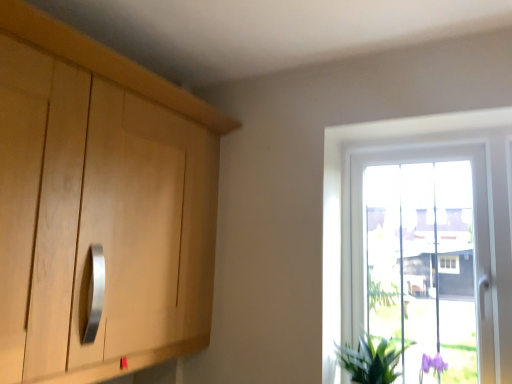
Question: From a real-world perspective, is transparent glass window at right above or below green leafy plant at lower right?

Choices:
 (A) below
 (B) above

Answer: (B)

Question: Is transparent glass window at right bigger or smaller than green leafy plant at lower right?

Choices:
 (A) small
 (B) big

Answer: (B)

Question: In terms of width, does transparent glass window at right look wider or thinner when compared to green leafy plant at lower right?

Choices:
 (A) wide
 (B) thin

Answer: (B)

Question: Which is correct: green leafy plant at lower right is inside transparent glass window at right, or outside of it?

Choices:
 (A) outside
 (B) inside

Answer: (A)

Question: Based on their positions, is green leafy plant at lower right located to the left or right of transparent glass window at right?

Choices:
 (A) left
 (B) right

Answer: (A)

Question: Considering the positions of green leafy plant at lower right and transparent glass window at right in the image, is green leafy plant at lower right bigger or smaller than transparent glass window at right?

Choices:
 (A) big
 (B) small

Answer: (B)

Question: Relative to transparent glass window at right, is green leafy plant at lower right in front or behind?

Choices:
 (A) front
 (B) behind

Answer: (A)